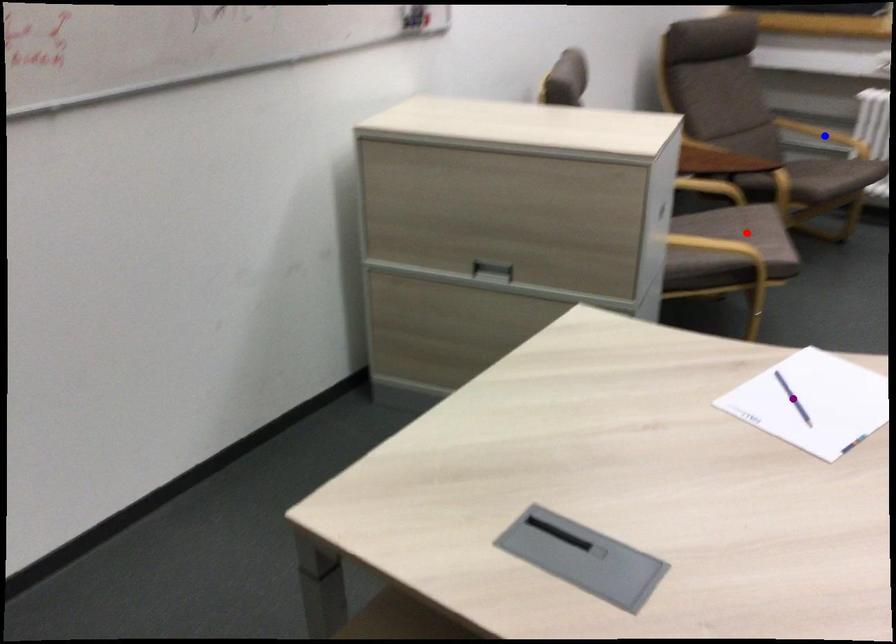
Order these from nearest to farthest:
1. blue point
2. red point
3. purple point

purple point → red point → blue point